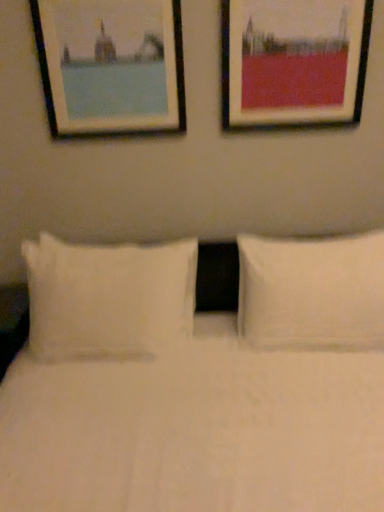
Question: Is matte black picture frame at upper right, the first picture frame viewed from the right, further to camera compared to white soft pillow at right, the second pillow viewed from the left?

Choices:
 (A) yes
 (B) no

Answer: (A)

Question: From the image's perspective, is matte black picture frame at upper right, the second picture frame in the left-to-right sequence, located beneath white soft pillow at right, which appears as the 1th pillow when viewed from the right?

Choices:
 (A) yes
 (B) no

Answer: (B)

Question: From a real-world perspective, is matte black picture frame at upper right, the first picture frame viewed from the right, physically above white soft pillow at right, the second pillow viewed from the left?

Choices:
 (A) no
 (B) yes

Answer: (B)

Question: Is matte black picture frame at upper right, the first picture frame viewed from the right, beside white soft pillow at right, which appears as the 1th pillow when viewed from the right?

Choices:
 (A) no
 (B) yes

Answer: (A)

Question: Can you confirm if matte black picture frame at upper right, the second picture frame in the left-to-right sequence, is smaller than white soft pillow at right, the second pillow viewed from the left?

Choices:
 (A) yes
 (B) no

Answer: (A)

Question: Is matte black picture frame at upper right, the second picture frame in the left-to-right sequence, at the right side of white soft pillow at right, which appears as the 1th pillow when viewed from the right?

Choices:
 (A) yes
 (B) no

Answer: (B)

Question: Considering the relative sizes of white soft pillow at right, the second pillow viewed from the left, and wooden frame at upper left, marked as the second picture frame in a right-to-left arrangement, in the image provided, is white soft pillow at right, the second pillow viewed from the left, smaller than wooden frame at upper left, marked as the second picture frame in a right-to-left arrangement,?

Choices:
 (A) no
 (B) yes

Answer: (A)

Question: From a real-world perspective, is white soft pillow at right, which appears as the 1th pillow when viewed from the right, on top of wooden frame at upper left, marked as the second picture frame in a right-to-left arrangement?

Choices:
 (A) yes
 (B) no

Answer: (B)

Question: Is white soft pillow at right, which appears as the 1th pillow when viewed from the right, located outside wooden frame at upper left, marked as the second picture frame in a right-to-left arrangement?

Choices:
 (A) yes
 (B) no

Answer: (A)

Question: Considering the relative sizes of white soft pillow at right, the second pillow viewed from the left, and wooden frame at upper left, marked as the second picture frame in a right-to-left arrangement, in the image provided, is white soft pillow at right, the second pillow viewed from the left, bigger than wooden frame at upper left, marked as the second picture frame in a right-to-left arrangement,?

Choices:
 (A) no
 (B) yes

Answer: (B)

Question: Would you say wooden frame at upper left, marked as the second picture frame in a right-to-left arrangement, is part of white soft pillow at right, the second pillow viewed from the left,'s contents?

Choices:
 (A) yes
 (B) no

Answer: (B)

Question: Would you consider white soft pillow at right, which appears as the 1th pillow when viewed from the right, to be distant from wooden frame at upper left, marked as the second picture frame in a right-to-left arrangement?

Choices:
 (A) yes
 (B) no

Answer: (B)

Question: Is there a large distance between white soft pillow at left, which is the second pillow in right-to-left order, and matte black picture frame at upper right, the first picture frame viewed from the right?

Choices:
 (A) yes
 (B) no

Answer: (B)